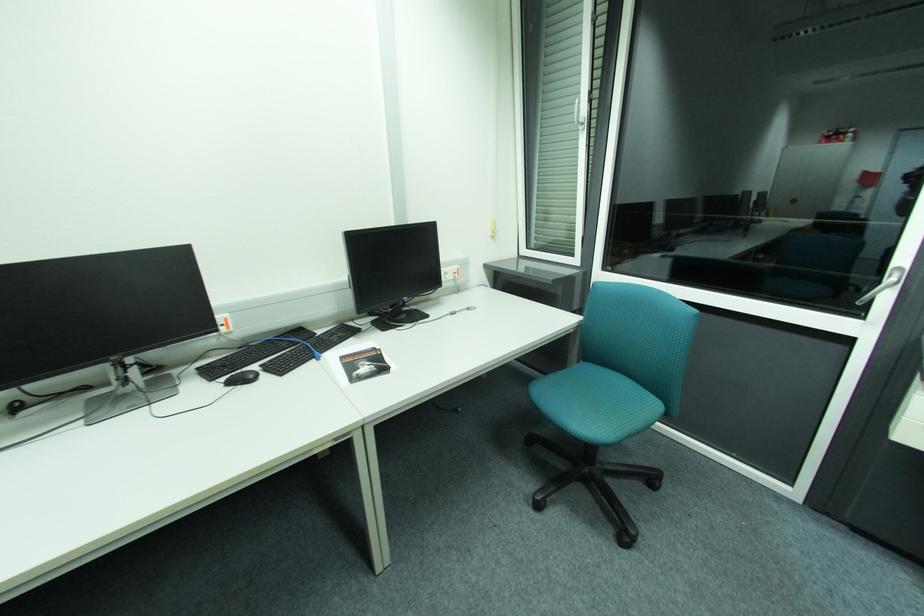
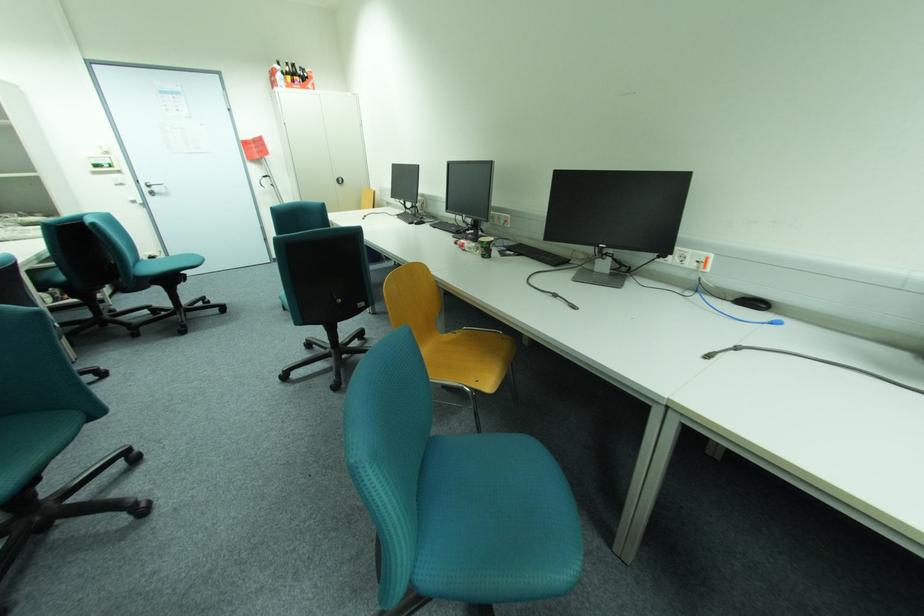
How did the camera likely rotate?

The camera rotated toward left-down.